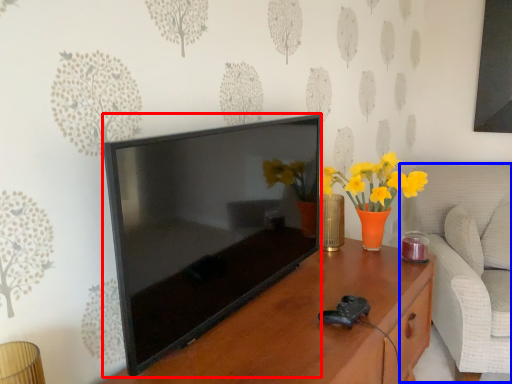
Question: Which of the following is the farthest to the observer, television (highlighted by a red box) or swivel chair (highlighted by a blue box)?

Choices:
 (A) television
 (B) swivel chair

Answer: (B)